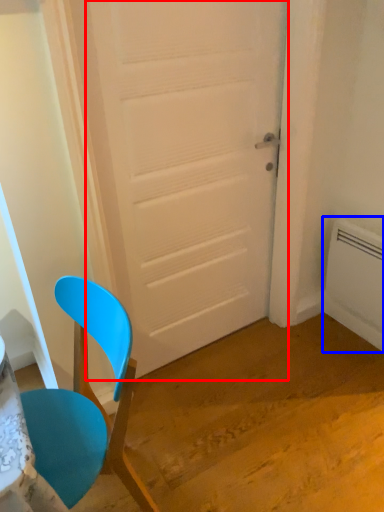
Question: Which object is further to the camera taking this photo, door (highlighted by a red box) or radiator (highlighted by a blue box)?

Choices:
 (A) door
 (B) radiator

Answer: (B)